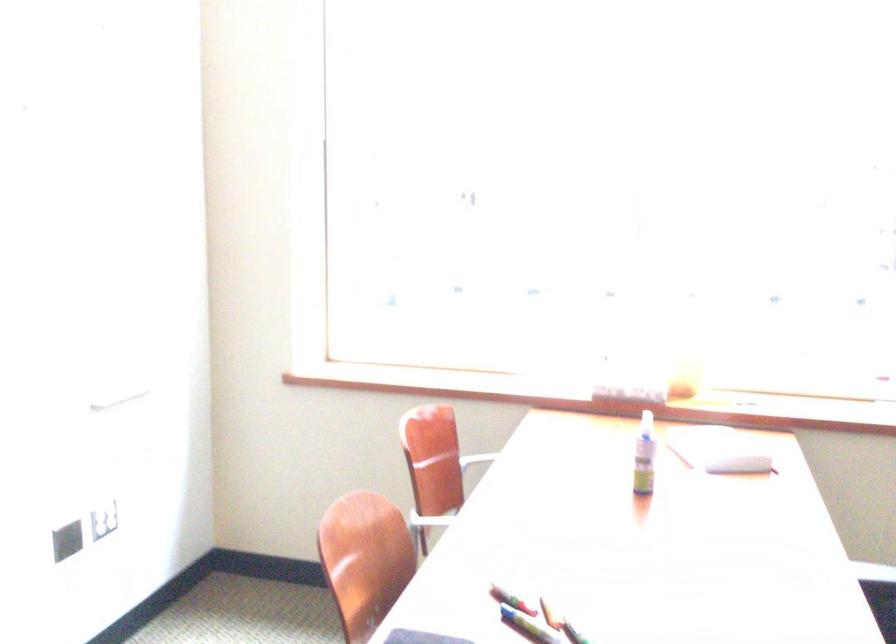
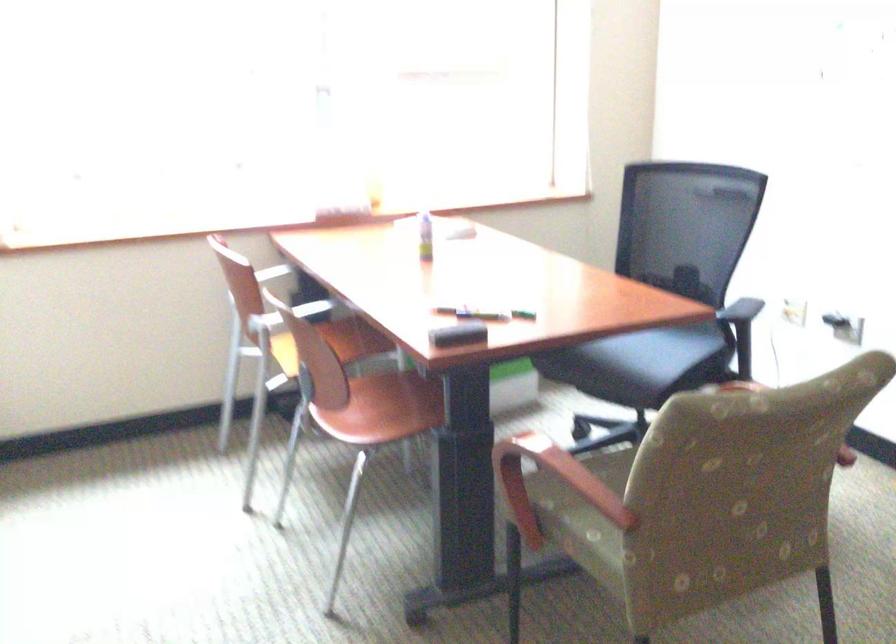
In the second image, find the point that corresponds to the point at 636,460 in the first image.

(425, 236)